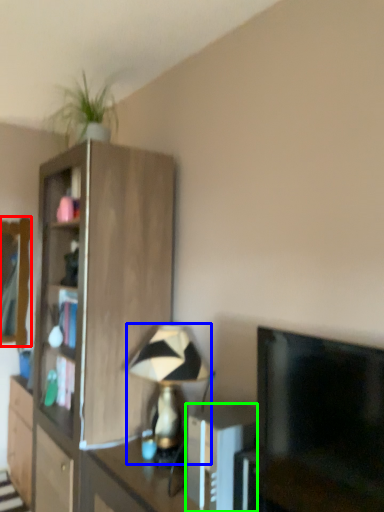
Question: Estimate the real-world distances between objects in this image. Which object is closer to mirror (highlighted by a red box), table lamp (highlighted by a blue box) or appliance (highlighted by a green box)?

Choices:
 (A) table lamp
 (B) appliance

Answer: (A)